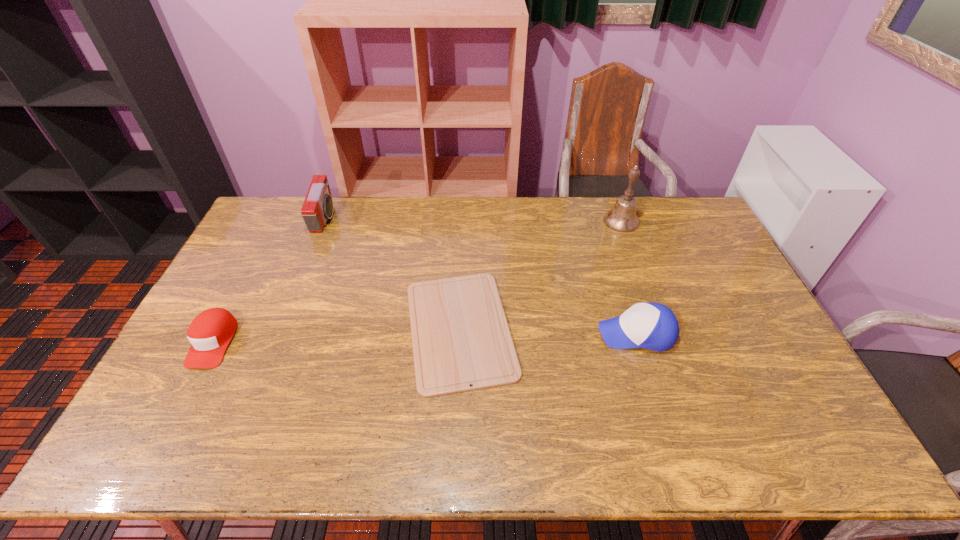
You are a GUI agent. You are given a task and a screenshot of the screen. Output one action in this format:
    pyautogui.click(x=<x>, y=<y>)
    Task: Click on the blank area at the right edge
    Image resolution: width=960 pixels, height=540 pixels.
    Given the screenshot: What is the action you would take?
    pyautogui.click(x=714, y=282)

The width and height of the screenshot is (960, 540). I want to click on vacant region at the far left corner of the desktop, so click(x=289, y=226).

At what (x,y) coordinates should I click in order to perform the action: click on free spot at the far right corner of the desktop. Please return your answer as a coordinate pair (x, y). Looking at the image, I should click on (693, 205).

Find the location of a particular element. The height and width of the screenshot is (540, 960). empty location between the shortest object and the camera is located at coordinates (393, 274).

Find the location of a particular element. unoccupied position between the third object from right to left and the third shortest object is located at coordinates (548, 331).

Locate an element on the screen. The width and height of the screenshot is (960, 540). unoccupied area between the shorter baseball cap and the chopping board is located at coordinates (337, 335).

Where is `vacant area between the shorter baseball cap and the bell`? This screenshot has height=540, width=960. vacant area between the shorter baseball cap and the bell is located at coordinates (418, 281).

Find the location of a particular element. This screenshot has height=540, width=960. vacant space that's between the right baseball cap and the bell is located at coordinates (629, 277).

The height and width of the screenshot is (540, 960). I want to click on vacant area that lies between the shortest object and the left baseball cap, so click(337, 335).

Locate an element on the screen. Image resolution: width=960 pixels, height=540 pixels. unoccupied position between the tallest object and the second object from left to right is located at coordinates (473, 220).